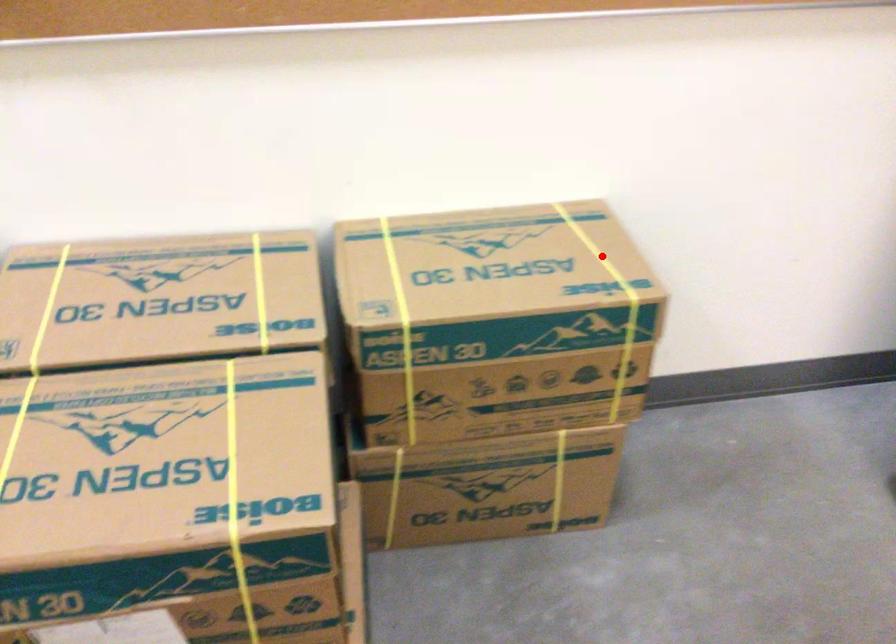
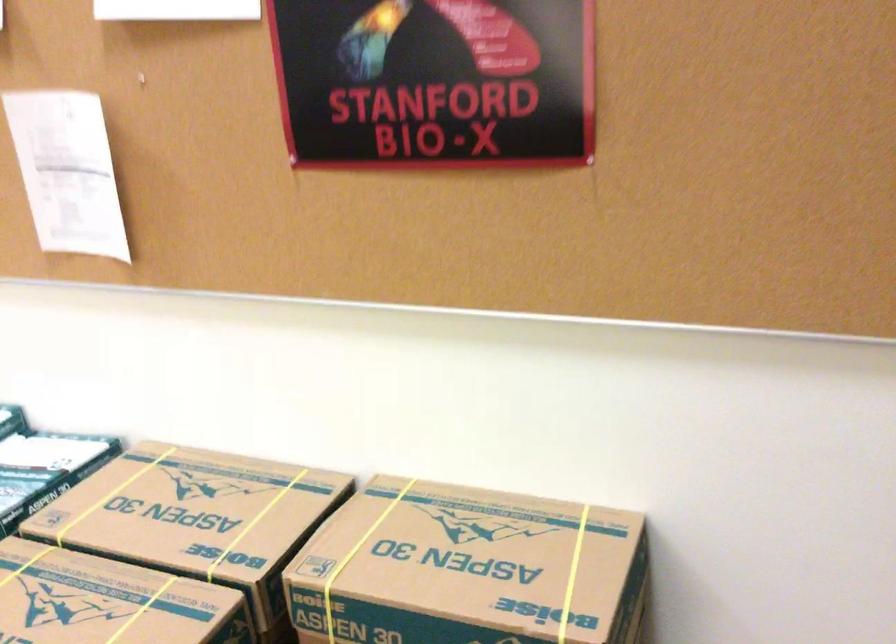
Question: I am providing you with two images of the same scene from different viewpoints. Given a red point in image1, look at the same physical point in image2. Is it:

Choices:
 (A) Closer to the viewpoint
 (B) Farther from the viewpoint

Answer: (A)